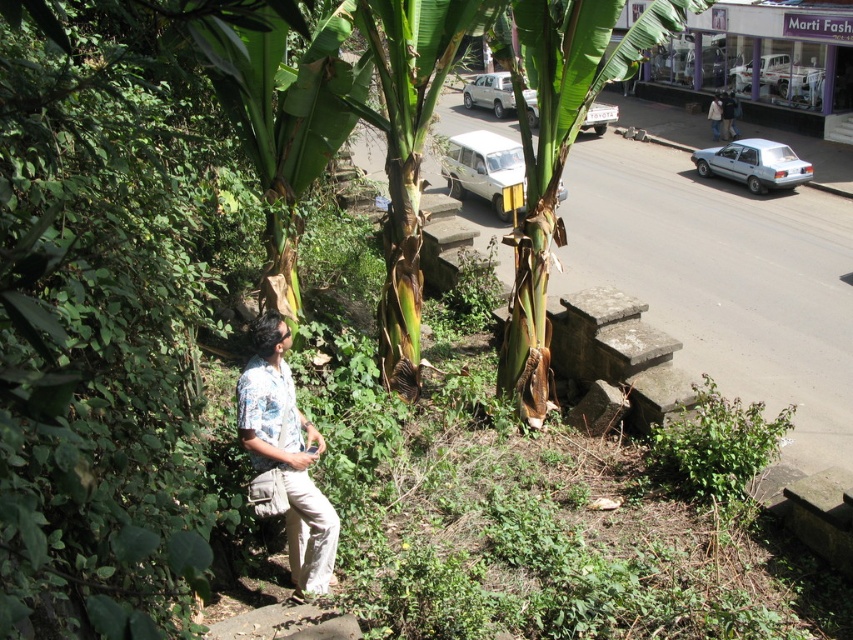
Question: Does green leafy banana tree at center come behind floral shirt at lower left?

Choices:
 (A) no
 (B) yes

Answer: (B)

Question: Which point is closer to the camera?

Choices:
 (A) (308, 429)
 (B) (543, 77)

Answer: (A)

Question: Which of the following is the farthest from the observer?

Choices:
 (A) (523, 237)
 (B) (276, 445)

Answer: (A)

Question: Is green leafy banana tree at center smaller than floral shirt at lower left?

Choices:
 (A) yes
 (B) no

Answer: (B)

Question: Does green leafy banana tree at center have a lesser width compared to floral shirt at lower left?

Choices:
 (A) no
 (B) yes

Answer: (A)

Question: Which point is closer to the camera taking this photo?

Choices:
 (A) (263, 440)
 (B) (527, 6)

Answer: (A)